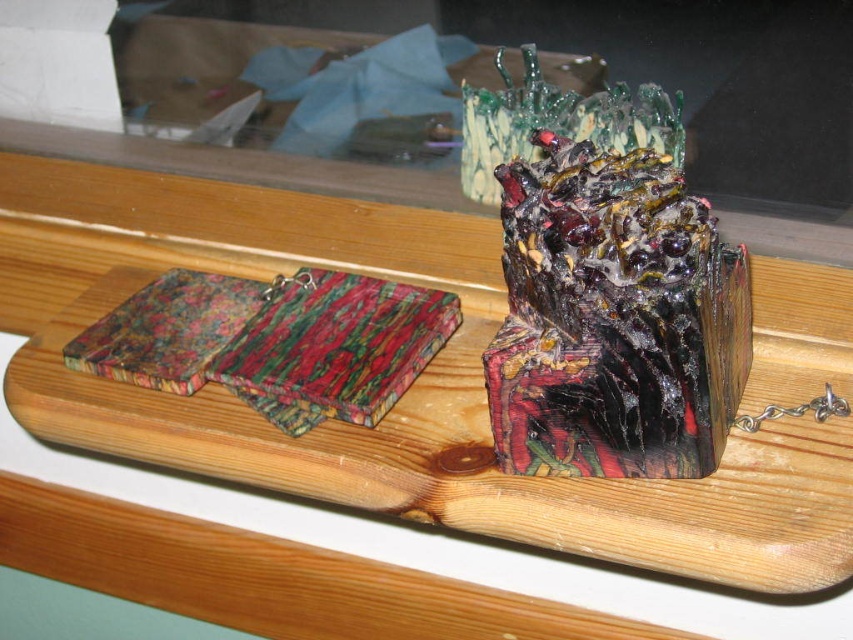
Can you confirm if glossy resin cube at center is wider than marbled wood coaster at left?

Correct, the width of glossy resin cube at center exceeds that of marbled wood coaster at left.

Image resolution: width=853 pixels, height=640 pixels. In order to click on glossy resin cube at center in this screenshot , I will do [614, 320].

Where is `glossy resin cube at center`? The image size is (853, 640). glossy resin cube at center is located at coordinates (614, 320).

Does wooden tray at center have a larger size compared to multicolored resin at center?

Correct, wooden tray at center is larger in size than multicolored resin at center.

Consider the image. Between wooden tray at center and multicolored resin at center, which one has less height?

multicolored resin at center

Which is in front, point (805, 339) or point (260, 364)?

Point (260, 364)

Locate an element on the screen. The image size is (853, 640). wooden tray at center is located at coordinates (467, 461).

Looking at this image, who is positioned more to the left, wooden tray at center or marbled wood coaster at left?

From the viewer's perspective, marbled wood coaster at left appears more on the left side.

Between wooden tray at center and marbled wood coaster at left, which one appears on the right side from the viewer's perspective?

Positioned to the right is wooden tray at center.

The width and height of the screenshot is (853, 640). What do you see at coordinates (467, 461) in the screenshot?
I see `wooden tray at center` at bounding box center [467, 461].

Find the location of a particular element. The height and width of the screenshot is (640, 853). wooden tray at center is located at coordinates (467, 461).